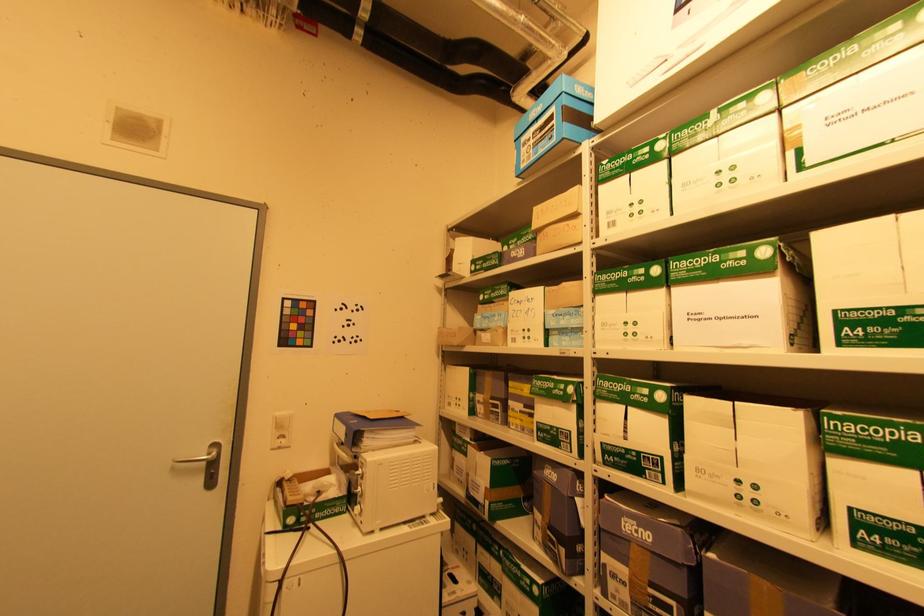
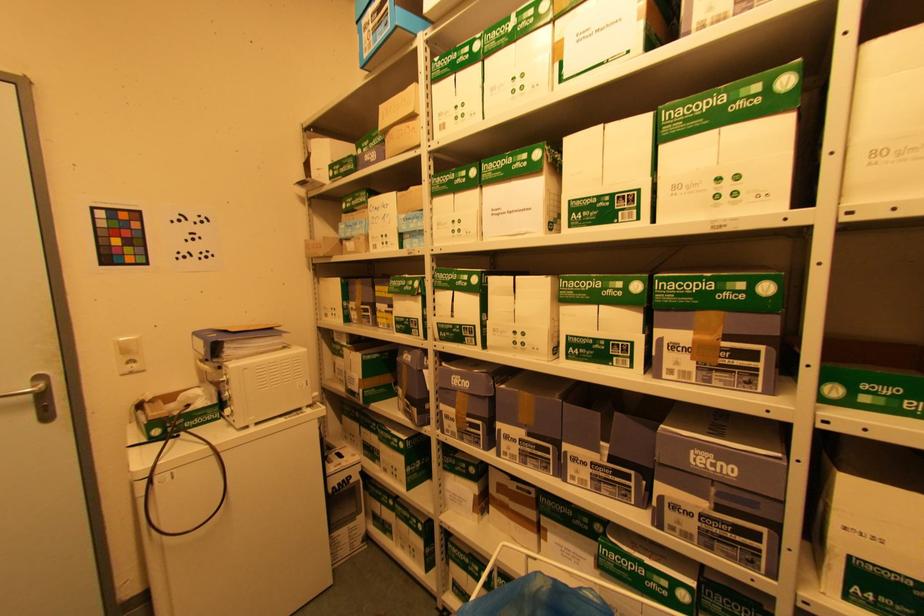
Question: The images are taken continuously from a first-person perspective. In which direction is your viewpoint rotating?

Choices:
 (A) Left
 (B) Right
 (C) Up
 (D) Down

Answer: (B)